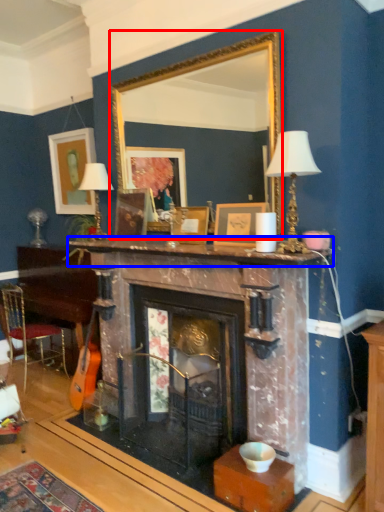
Question: Which object appears closest to the camera in this image, mirror (highlighted by a red box) or mantle (highlighted by a blue box)?

Choices:
 (A) mirror
 (B) mantle

Answer: (B)